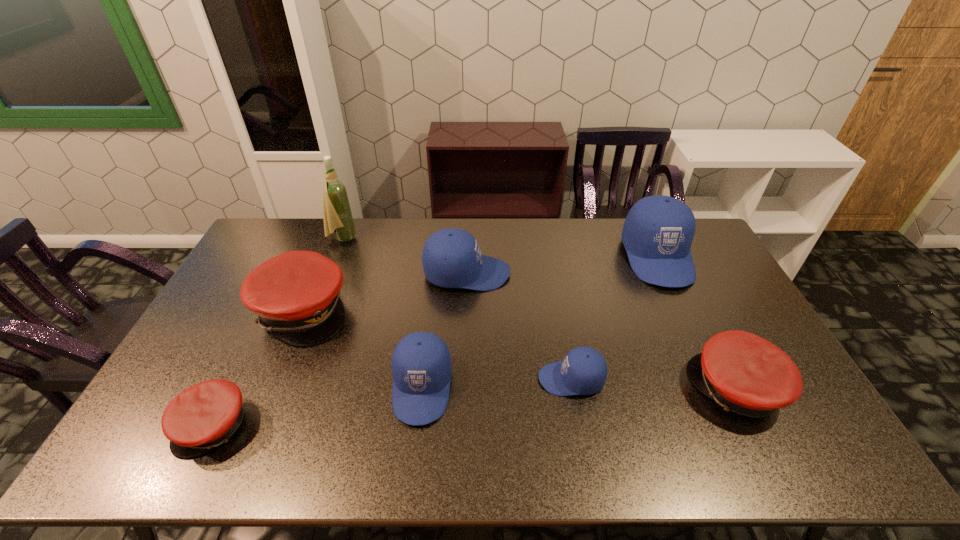
Find the location of `wine bottle`. wine bottle is located at coordinates (337, 214).

You are a GUI agent. You are given a task and a screenshot of the screen. Output one action in this format:
    pyautogui.click(x=<x>, y=<y>)
    Task: Click on the rightmost blue cap
    
    Given the screenshot: What is the action you would take?
    pyautogui.click(x=658, y=231)

Image resolution: width=960 pixels, height=540 pixels. In order to click on the tallest cap in this screenshot , I will do `click(658, 231)`.

You are a GUI agent. You are given a task and a screenshot of the screen. Output one action in this format:
    pyautogui.click(x=<x>, y=<y>)
    Task: Click on the sixth shortest object
    The height and width of the screenshot is (540, 960).
    Given the screenshot: What is the action you would take?
    click(451, 258)

This screenshot has width=960, height=540. I want to click on the second tallest cap, so click(x=451, y=258).

This screenshot has height=540, width=960. Identify the location of the farthest red cap. (296, 294).

The image size is (960, 540). Find the location of `the third biggest blue cap`. the third biggest blue cap is located at coordinates (421, 364).

At what (x,y) coordinates should I click in order to perform the action: click on the rightmost red cap. Please return your answer as a coordinate pair (x, y). The height and width of the screenshot is (540, 960). Looking at the image, I should click on (742, 372).

The width and height of the screenshot is (960, 540). What are the coordinates of `the smallest blue cap` in the screenshot? It's located at (583, 371).

Locate an element on the screen. This screenshot has width=960, height=540. the fifth cap from left to right is located at coordinates (583, 371).